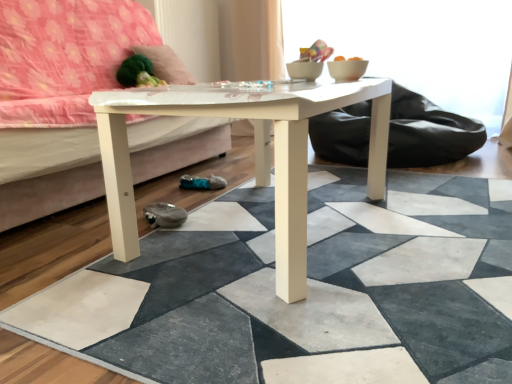
What do you see at coordinates (47, 171) in the screenshot? This screenshot has height=384, width=512. I see `white glossy studio couch at center` at bounding box center [47, 171].

Locate an element on the screen. white glossy studio couch at center is located at coordinates (47, 171).

Is white glossy studio couch at center aimed at velvety green pillow at upper left?

No, white glossy studio couch at center is not aimed at velvety green pillow at upper left.

Is white glossy studio couch at center at the right side of velvety green pillow at upper left?

No.

From the image's perspective, which is below, white glossy studio couch at center or velvety green pillow at upper left?

white glossy studio couch at center.

Considering the sizes of white glossy studio couch at center and velvety green pillow at upper left in the image, is white glossy studio couch at center taller or shorter than velvety green pillow at upper left?

Considering their sizes, white glossy studio couch at center has more height than velvety green pillow at upper left.

Considering the sizes of objects white matte tile at center and velvety green pillow at upper left in the image provided, who is wider, white matte tile at center or velvety green pillow at upper left?

With larger width is white matte tile at center.

From a real-world perspective, who is located higher, white matte tile at center or velvety green pillow at upper left?

In real-world perspective, velvety green pillow at upper left is above.

Is white matte tile at center spatially inside velvety green pillow at upper left, or outside of it?

The correct answer is: outside.

From the image's perspective, which is above, white matte tile at center or velvety green pillow at upper left?

From the image's view, velvety green pillow at upper left is above.

How far apart are velvety green pillow at upper left and white glossy studio couch at center?

They are 24.98 inches apart.

Looking at the image, does velvety green pillow at upper left seem bigger or smaller compared to white glossy studio couch at center?

Clearly, velvety green pillow at upper left is smaller in size than white glossy studio couch at center.

From the image's perspective, between velvety green pillow at upper left and white glossy studio couch at center, which one is located above?

velvety green pillow at upper left, from the image's perspective.

Between velvety green pillow at upper left and white glossy studio couch at center, which one appears on the right side from the viewer's perspective?

velvety green pillow at upper left.

Is white glossy studio couch at center thinner than white matte tile at center?

Correct, the width of white glossy studio couch at center is less than that of white matte tile at center.

The width and height of the screenshot is (512, 384). I want to click on tile that is under the white glossy studio couch at center (from a real-world perspective), so click(x=308, y=291).

From the image's perspective, is white glossy studio couch at center above white matte tile at center?

Yes, from the image's perspective, white glossy studio couch at center is over white matte tile at center.

Consider the image. Which object is positioned more to the left, white matte tile at center or white glossy studio couch at center?

Positioned to the left is white glossy studio couch at center.

From the image's perspective, which object appears higher, white matte tile at center or white glossy studio couch at center?

white glossy studio couch at center.

Is white matte tile at center smaller than white glossy studio couch at center?

Indeed, white matte tile at center has a smaller size compared to white glossy studio couch at center.

How distant is velvety green pillow at upper left from white glossy coffee table at center?

1.35 meters.

Is velvety green pillow at upper left oriented towards white glossy coffee table at center?

No.

Are velvety green pillow at upper left and white glossy coffee table at center located far from each other?

Yes, velvety green pillow at upper left is far from white glossy coffee table at center.

Identify the location of pillow located on the left of white glossy coffee table at center. (166, 64).

How far apart are white glossy studio couch at center and white glossy coffee table at center?

white glossy studio couch at center and white glossy coffee table at center are 64.52 centimeters apart from each other.

Between white glossy studio couch at center and white glossy coffee table at center, which one is positioned in front?

white glossy coffee table at center is more forward.

Considering the sizes of objects white glossy studio couch at center and white glossy coffee table at center in the image provided, who is taller, white glossy studio couch at center or white glossy coffee table at center?

white glossy studio couch at center.

At what (x,y) coordinates should I click in order to perform the action: click on studio couch on the left side of velvety green pillow at upper left. Please return your answer as a coordinate pair (x, y). Looking at the image, I should click on (47, 171).

Identify the location of tile below the velvety green pillow at upper left (from the image's perspective). The image size is (512, 384). (308, 291).

When comparing their distances from white glossy coffee table at center, does white matte tile at center or white glossy studio couch at center seem closer?

white matte tile at center.

Which object lies further to the anchor point white matte tile at center, white glossy studio couch at center or velvety green pillow at upper left?

The object further to white matte tile at center is velvety green pillow at upper left.

When comparing their distances from white glossy studio couch at center, does white glossy coffee table at center or velvety green pillow at upper left seem further?

Based on the image, white glossy coffee table at center appears to be further to white glossy studio couch at center.

When comparing their distances from white matte tile at center, does velvety green pillow at upper left or white glossy coffee table at center seem further?

velvety green pillow at upper left is further to white matte tile at center.

From the image, which object appears to be nearer to velvety green pillow at upper left, white glossy coffee table at center or white glossy studio couch at center?

Based on the image, white glossy studio couch at center appears to be nearer to velvety green pillow at upper left.

Based on their spatial positions, is velvety green pillow at upper left or white glossy studio couch at center further from white glossy coffee table at center?

Among the two, velvety green pillow at upper left is located further to white glossy coffee table at center.

Estimate the real-world distances between objects in this image. Which object is closer to white glossy studio couch at center, white matte tile at center or velvety green pillow at upper left?

The object closer to white glossy studio couch at center is velvety green pillow at upper left.

When comparing their distances from velvety green pillow at upper left, does white matte tile at center or white glossy coffee table at center seem further?

Based on the image, white matte tile at center appears to be further to velvety green pillow at upper left.

The image size is (512, 384). What are the coordinates of `studio couch between white glossy coffee table at center and velvety green pillow at upper left from front to back` in the screenshot? It's located at (47, 171).

Image resolution: width=512 pixels, height=384 pixels. I want to click on coffee table between white matte tile at center and velvety green pillow at upper left from front to back, so click(x=255, y=153).

This screenshot has width=512, height=384. Identify the location of coffee table between white glossy studio couch at center and white matte tile at center. (255, 153).

You are a GUI agent. You are given a task and a screenshot of the screen. Output one action in this format:
    pyautogui.click(x=<x>, y=<y>)
    Task: Click on the studio couch between white matte tile at center and velvety green pillow at upper left from front to back
    
    Given the screenshot: What is the action you would take?
    pyautogui.click(x=47, y=171)